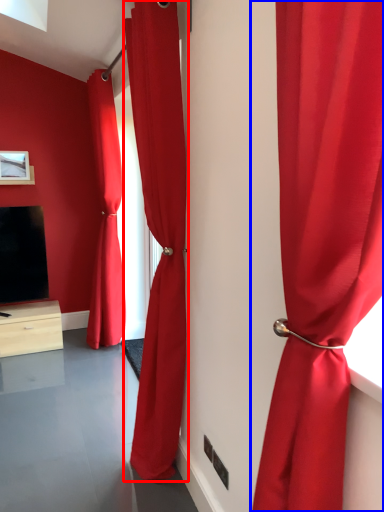
Question: Which point is further to the camera, curtain (highlighted by a red box) or curtain (highlighted by a blue box)?

Choices:
 (A) curtain
 (B) curtain

Answer: (A)